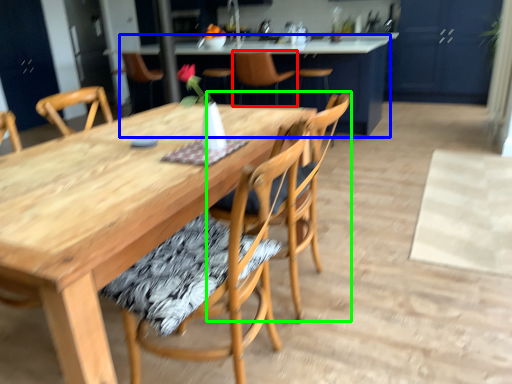
Question: Estimate the real-world distances between objects in this image. Which object is closer to chair (highlighted by a red box), table (highlighted by a blue box) or chair (highlighted by a green box)?

Choices:
 (A) table
 (B) chair

Answer: (A)